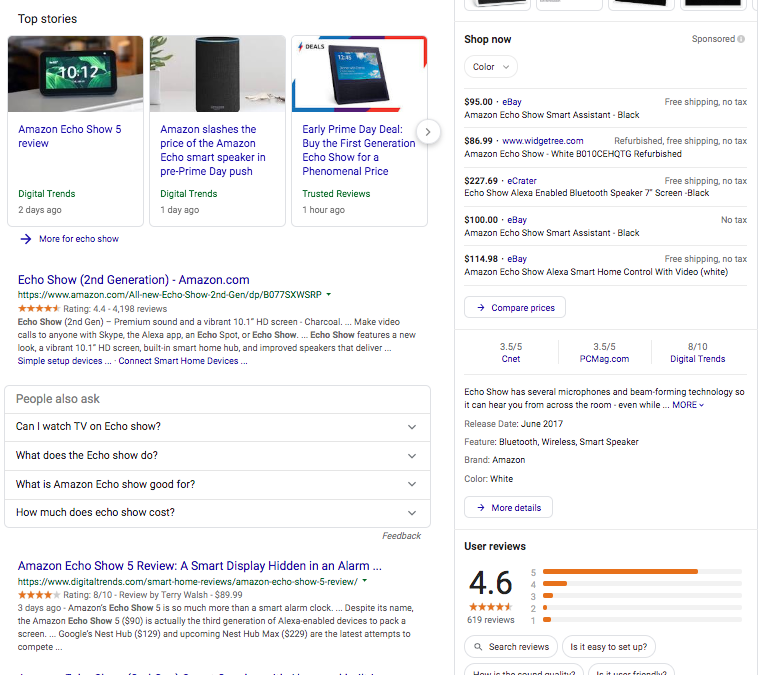
Where is `black border on screen`? black border on screen is located at coordinates click(362, 92).